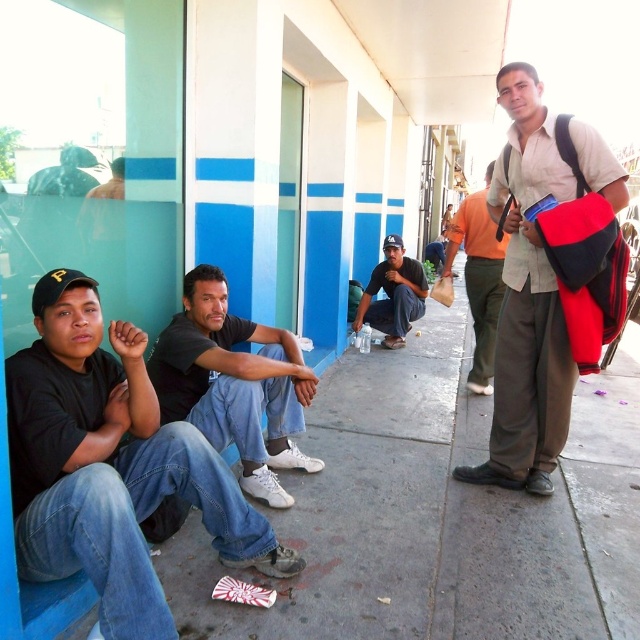
You are a photographer trying to capture a clear shot of the dark gray cotton shirt at center and the matte black cap at center. Which object should you focus on first to ensure both are in focus?

You should focus on the dark gray cotton shirt at center first since it is closer to the viewer than the matte black cap at center, ensuring both will be in focus when using a proper depth of field.

You are a photographer trying to capture both the orange cotton shirt at right and the matte black cap at center in the same frame. Which object should you focus on first to ensure both are in focus?

The orange cotton shirt at right is thinner than the matte black cap at center, so you should focus on the matte black cap at center first to ensure both are in focus.